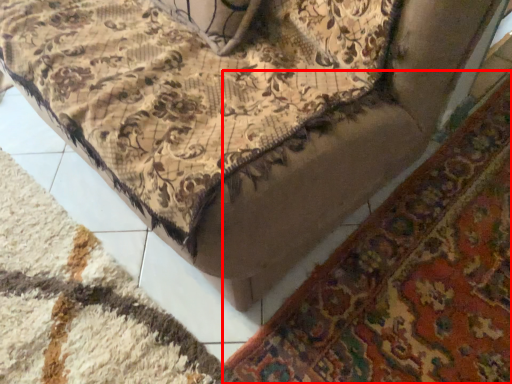
Question: From the image, what is the correct spatial relationship of mat (annotated by the red box) in relation to mat?

Choices:
 (A) left
 (B) right

Answer: (B)